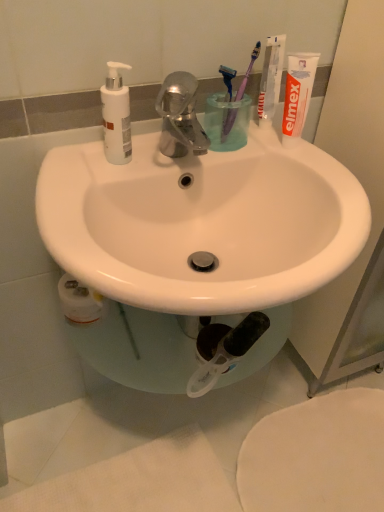
Identify the location of free spot to the left of white matte pump bottle at upper left. This screenshot has width=384, height=512. (70, 159).